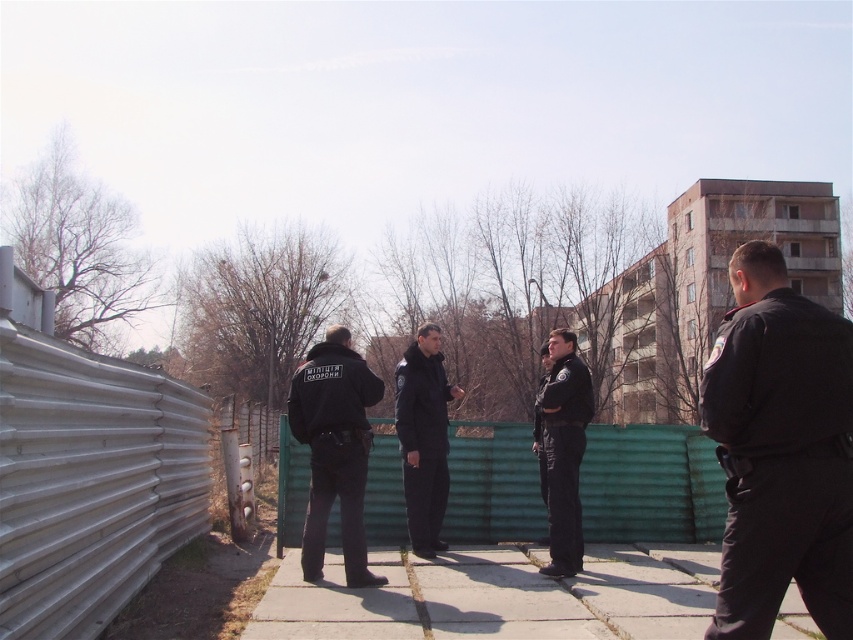
Question: Which point is farther to the camera?

Choices:
 (A) (341, 365)
 (B) (500, 536)
 (C) (699, 588)
 (D) (581, 538)

Answer: (B)

Question: Is gray concrete pavement at center thinner than green corrugated metal fence at center?

Choices:
 (A) yes
 (B) no

Answer: (B)

Question: Does black matte uniform at right have a greater width compared to black matte jacket at center?

Choices:
 (A) no
 (B) yes

Answer: (A)

Question: Is black matte uniform at right wider than dark blue uniform at center?

Choices:
 (A) no
 (B) yes

Answer: (A)

Question: Which object is the farthest from the green corrugated metal fence at center?

Choices:
 (A) black matte jacket at center
 (B) gray concrete pavement at center
 (C) black matte uniform at right
 (D) dark blue uniform at center

Answer: (C)

Question: Which of the following is the closest to the observer?

Choices:
 (A) (508, 426)
 (B) (416, 401)
 (C) (370, 586)
 (D) (746, 404)

Answer: (D)